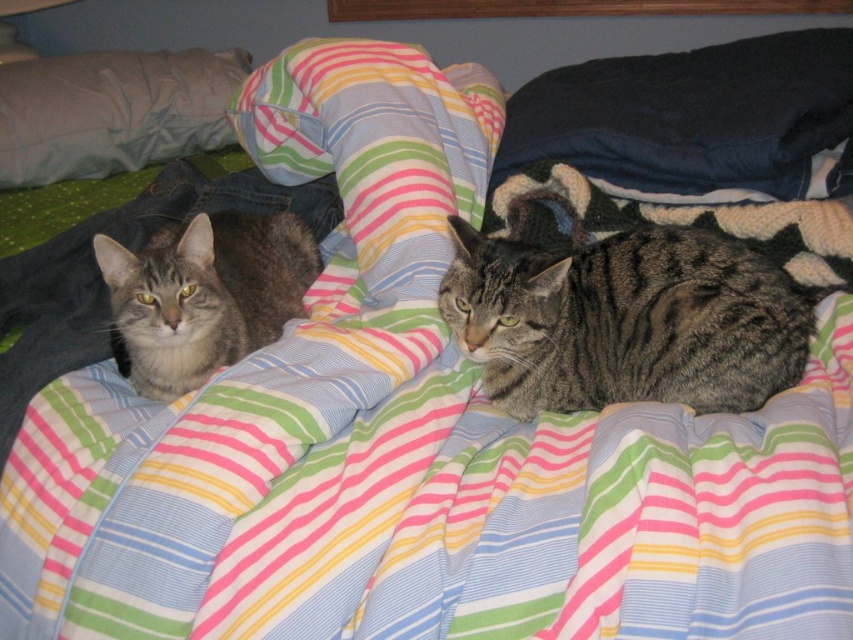
You are a cat owner who wants to place a small toy between the dark blue fabric pillow at upper right and the pillow at upper left. Which pillow has a wider base to ensure the toy stays centered?

The dark blue fabric pillow at upper right has a wider base than the pillow at upper left, so placing the toy closer to the center between them would require considering the wider pillow for stability.

From the picture: You are trying to place a small toy for the cats on the bed. The cats are currently near the dark blue fabric pillow at upper right. Where should you place the toy so it is farthest from the cats?

The dark blue fabric pillow at upper right is located at point (689,115), so placing the toy near the opposite corner of the bed would be farthest from the cats.